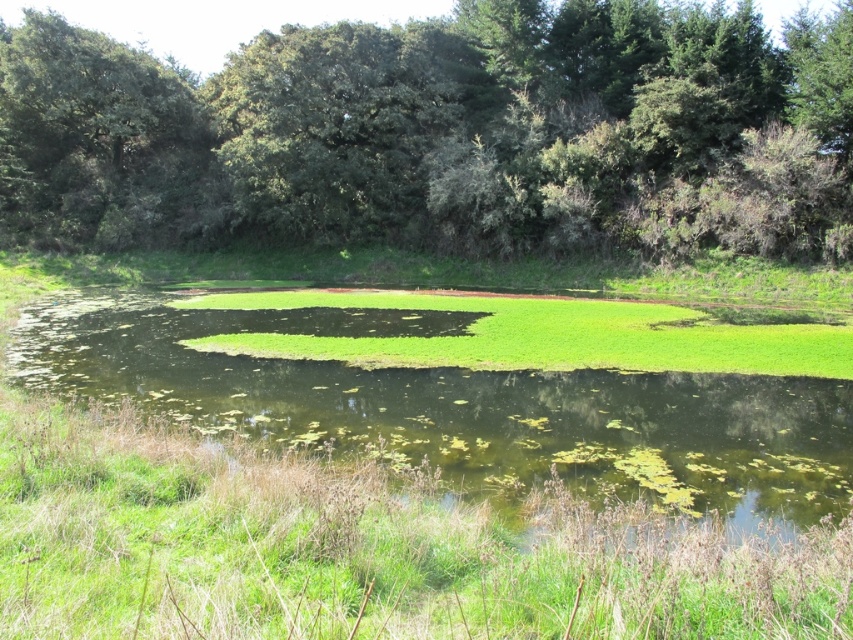
Is point (105, 45) closer to viewer compared to point (15, 74)?

No, it is not.

Does green leafy trees at upper center have a greater width compared to green leafy tree at upper left?

Yes, green leafy trees at upper center is wider than green leafy tree at upper left.

Between point (520, 177) and point (148, 180), which one is positioned in front?

Positioned in front is point (520, 177).

Where is `green leafy trees at upper center`? Image resolution: width=853 pixels, height=640 pixels. green leafy trees at upper center is located at coordinates (444, 132).

Does green leafy trees at upper center appear under green algae at center?

Incorrect, green leafy trees at upper center is not positioned below green algae at center.

Is the position of green leafy trees at upper center more distant than that of green algae at center?

That is True.

Is point (184, 179) more distant than point (276, 401)?

That is True.

I want to click on green leafy trees at upper center, so click(444, 132).

Which is more to the right, green algae at center or green leafy tree at upper left?

Positioned to the right is green algae at center.

Does point (254, 433) come closer to viewer compared to point (16, 161)?

Yes.

Image resolution: width=853 pixels, height=640 pixels. I want to click on green algae at center, so click(x=457, y=406).